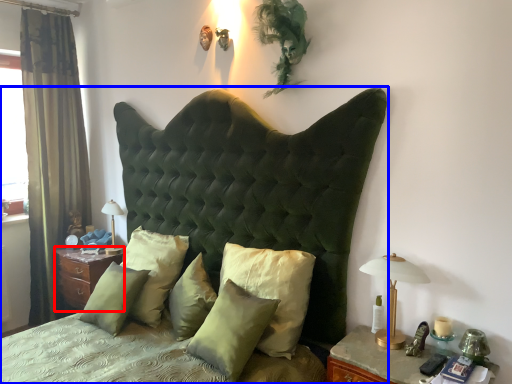
Question: Which of the following is the closest to the observer, nightstand (highlighted by a red box) or bed (highlighted by a blue box)?

Choices:
 (A) nightstand
 (B) bed

Answer: (B)